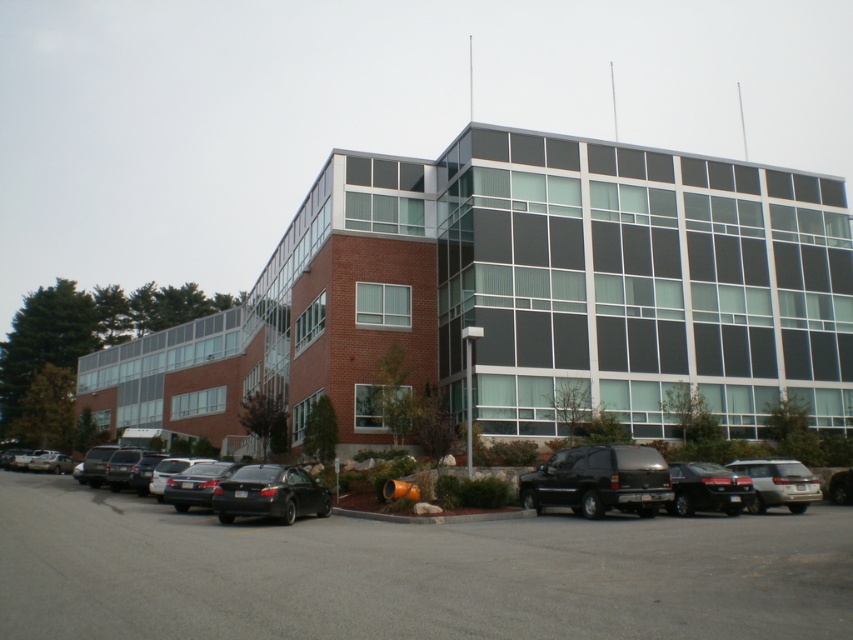
Who is lower down, gray asphalt parking lot at lower center or black matte suv at center?

gray asphalt parking lot at lower center is below.

Is point (7, 490) closer to viewer compared to point (619, 472)?

No, (7, 490) is behind (619, 472).

Does point (491, 627) lie in front of point (589, 516)?

Yes, it is.

Locate an element on the screen. gray asphalt parking lot at lower center is located at coordinates (410, 573).

Can you confirm if black matte suv at center is taller than satin black suv at center?

Yes, black matte suv at center is taller than satin black suv at center.

Does black matte suv at center have a larger size compared to satin black suv at center?

Indeed, black matte suv at center has a larger size compared to satin black suv at center.

Locate an element on the screen. black matte suv at center is located at coordinates [x=599, y=481].

The height and width of the screenshot is (640, 853). Find the location of `black matte suv at center`. black matte suv at center is located at coordinates (599, 481).

Who is positioned more to the right, glossy black sedan at lower left or satin black suv at center?

Positioned to the right is satin black suv at center.

The height and width of the screenshot is (640, 853). What do you see at coordinates (270, 493) in the screenshot? I see `glossy black sedan at lower left` at bounding box center [270, 493].

Which is behind, point (312, 499) or point (741, 493)?

The point (741, 493) is behind.

Identify the location of glossy black sedan at lower left. (270, 493).